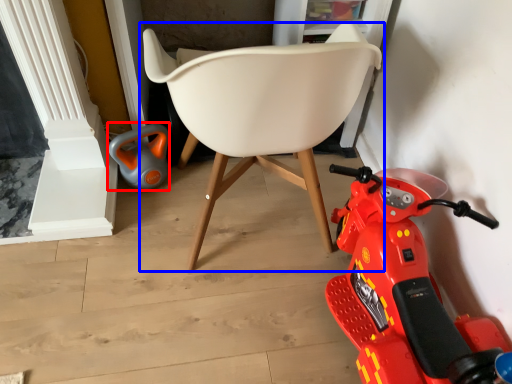
Question: Which point is closer to the camera, toy (highlighted by a red box) or chair (highlighted by a blue box)?

Choices:
 (A) toy
 (B) chair

Answer: (B)